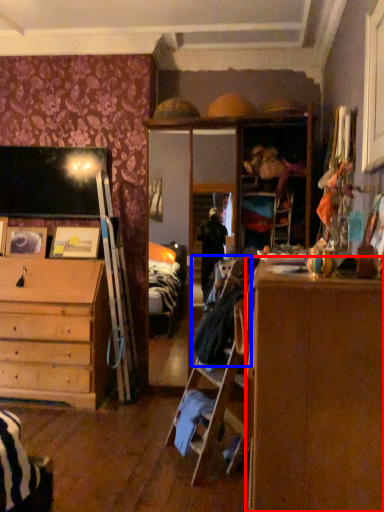
Question: Which point is further to the camera, cabinetry (highlighted by a red box) or laundry (highlighted by a blue box)?

Choices:
 (A) cabinetry
 (B) laundry

Answer: (B)